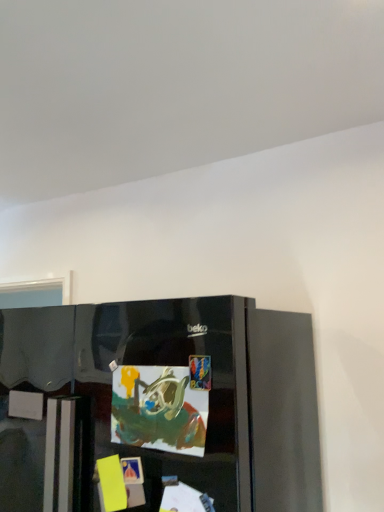
This screenshot has width=384, height=512. What do you see at coordinates (158, 405) in the screenshot? I see `glossy black refrigerator at lower center` at bounding box center [158, 405].

What is the approximate width of glossy black refrigerator at lower center?

It is 31.12 inches.

You are a GUI agent. You are given a task and a screenshot of the screen. Output one action in this format:
    pyautogui.click(x=<x>, y=<y>)
    Task: Click on the glossy black refrigerator at lower center
    Image resolution: width=384 pixels, height=512 pixels.
    Given the screenshot: What is the action you would take?
    [x=158, y=405]

Measure the distance between point (241,483) and camera.

Point (241,483) and camera are 37.44 inches apart.

Locate an element on the screen. glossy black refrigerator at lower center is located at coordinates (158, 405).